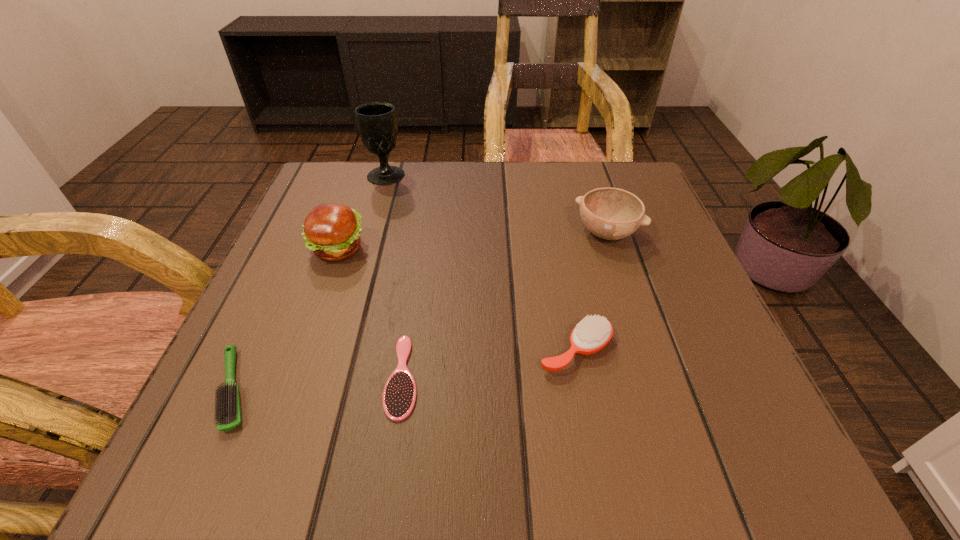
This screenshot has width=960, height=540. In the image, there is a desktop. Identify the location of free space at the far right corner. (574, 165).

What are the coordinates of `vacant space at the near right corner` in the screenshot? It's located at (683, 417).

The height and width of the screenshot is (540, 960). Find the location of `vacant area between the tallest object and the fifth shortest object`. vacant area between the tallest object and the fifth shortest object is located at coordinates (362, 212).

Find the location of a particular element. Image resolution: width=960 pixels, height=540 pixels. blank region between the hamburger and the fourth shortest object is located at coordinates (472, 241).

Locate an element on the screen. This screenshot has width=960, height=540. free area in between the tallest object and the tallest hairbrush is located at coordinates (481, 262).

Find the location of a particular element. This screenshot has width=960, height=540. empty location between the tallest object and the bowl is located at coordinates (496, 204).

This screenshot has width=960, height=540. Find the location of `free space that is in between the second shortest object and the tallest object`. free space that is in between the second shortest object and the tallest object is located at coordinates (310, 282).

Identify the location of vacant space that's between the hamburger and the third shortest object. (456, 300).

Locate an element on the screen. The width and height of the screenshot is (960, 540). free space between the tallest hairbrush and the fourth object from left to right is located at coordinates (490, 363).

Locate an element on the screen. vacant space that's between the tallest object and the rightmost hairbrush is located at coordinates (481, 262).